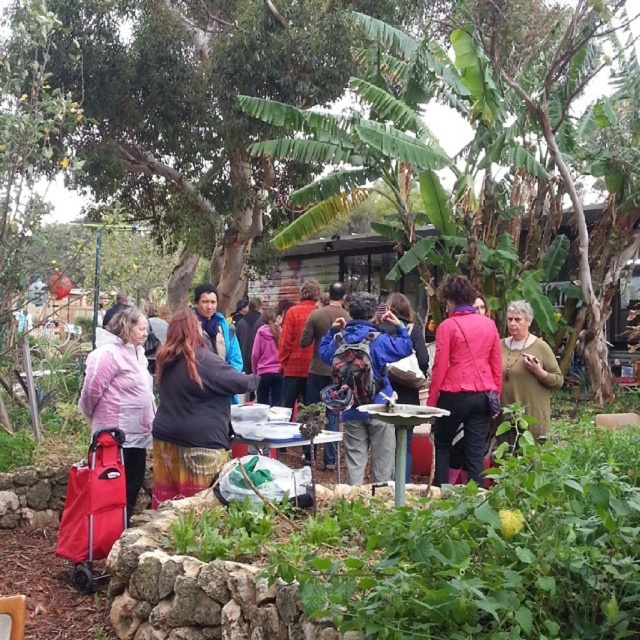
Question: Which object is closer to the camera taking this photo?

Choices:
 (A) blue backpack at center
 (B) multicolored woven skirt at center
 (C) white plastic picnic table at center
 (D) matte pink jacket at left

Answer: (B)

Question: Is multicolored woven skirt at center positioned behind matte pink jacket at left?

Choices:
 (A) no
 (B) yes

Answer: (A)

Question: Is the position of matte black jacket at center less distant than that of green textured sweater at center?

Choices:
 (A) yes
 (B) no

Answer: (B)

Question: Observing the image, what is the correct spatial positioning of blue backpack at center in reference to green textured sweater at center?

Choices:
 (A) below
 (B) above

Answer: (A)

Question: Among these objects, which one is nearest to the camera?

Choices:
 (A) blue backpack at center
 (B) green textured sweater at center

Answer: (A)

Question: Estimate the real-world distances between objects in this image. Which object is farther from the multicolored woven skirt at center?

Choices:
 (A) matte black jacket at center
 (B) matte pink jacket at center

Answer: (A)